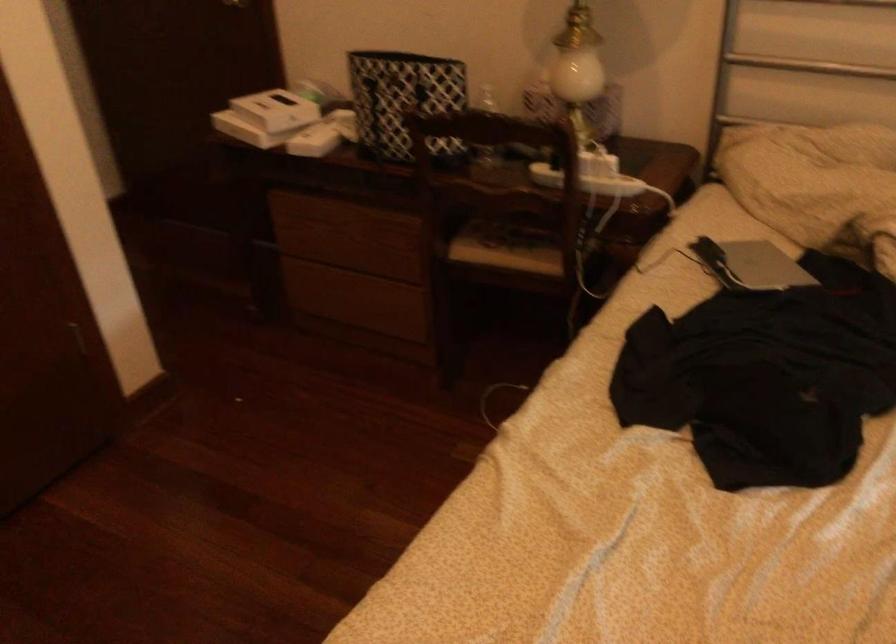
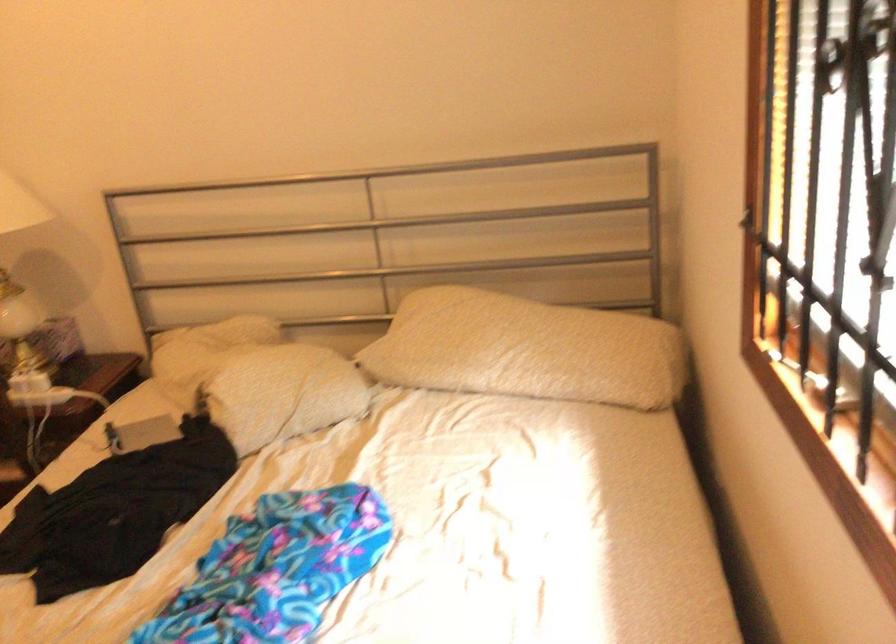
What movement of the cameraman would produce the second image?

The movement direction of the cameraman is right, backward.